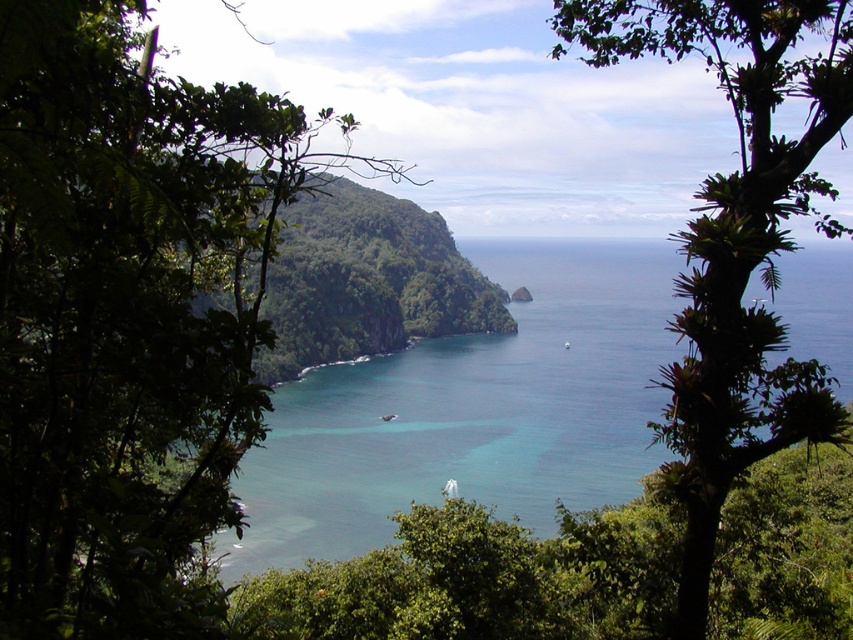
Can you confirm if green leafy tree at center is smaller than clear blue water at center?

Correct, green leafy tree at center occupies less space than clear blue water at center.

Can you confirm if green leafy tree at center is positioned below clear blue water at center?

Indeed, green leafy tree at center is positioned under clear blue water at center.

Does point (16, 125) come closer to viewer compared to point (306, 451)?

That is True.

Where is `green leafy tree at center`? The image size is (853, 640). green leafy tree at center is located at coordinates (128, 317).

Does green leafy tree at center have a greater height compared to green leafy tree at right?

No.

Between green leafy tree at center and green leafy tree at right, which one is positioned lower?

green leafy tree at center is below.

Does point (143, 266) come in front of point (749, 419)?

Yes.

Identify the location of green leafy tree at center. This screenshot has width=853, height=640. (128, 317).

Is clear blue water at center positioned behind green leafy tree at right?

Yes, clear blue water at center is further from the viewer.

Consider the image. Measure the distance from clear blue water at center to green leafy tree at right.

clear blue water at center and green leafy tree at right are 96.40 meters apart.

Which is behind, point (569, 387) or point (727, 228)?

The point (569, 387) is behind.

At what (x,y) coordinates should I click in order to perform the action: click on clear blue water at center. Please return your answer as a coordinate pair (x, y). The width and height of the screenshot is (853, 640). Looking at the image, I should click on (473, 410).